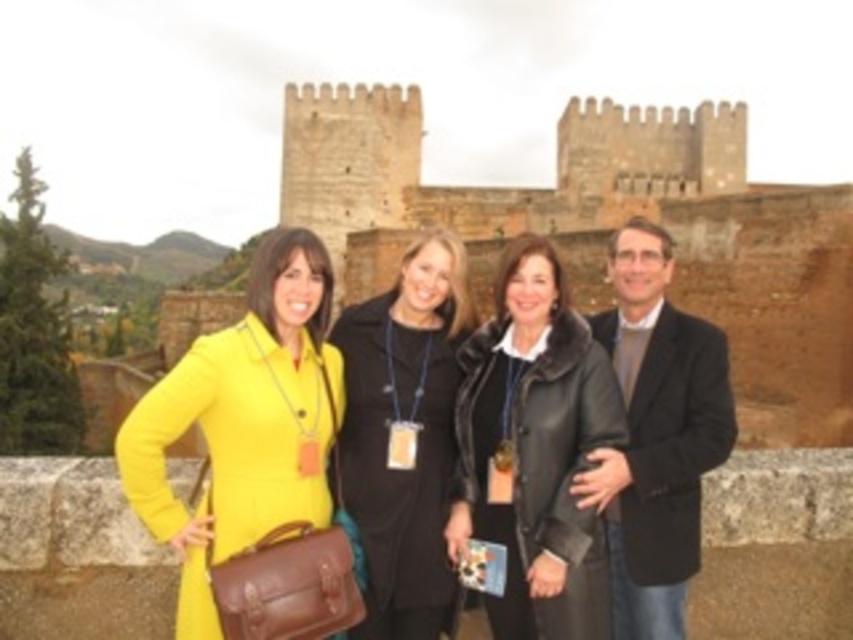
You are a photographer trying to capture a group photo of the two women wearing the black leather coat at center and dark gray wool blazer at center. Based on their positions, which one should you focus on first to ensure they are both in the frame?

The black leather coat at center is below dark gray wool blazer at center, so you should focus on the dark gray wool blazer at center first to ensure both are in the frame.

You are a photographer trying to capture a group photo of the two women in yellow matte coat at center and dark gray wool blazer at center. Since the camera can only focus on one person clearly, which woman should you focus on to ensure the closest subject is sharp?

The yellow matte coat at center is closer to the viewer than the dark gray wool blazer at center, so you should focus on the woman wearing the yellow matte coat at center to ensure the closest subject is sharp.